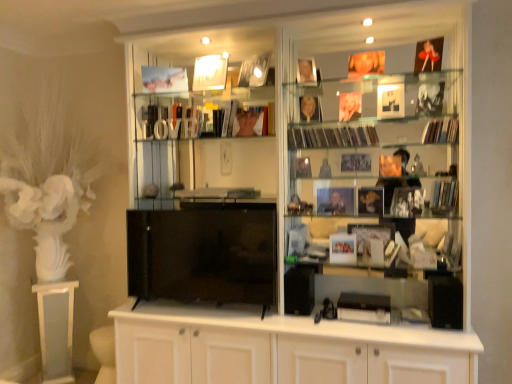
Question: Choose the correct answer: Is shiny plastic magazines at center right, arranged as the 2th magazine when viewed from the top, inside matte paper magazine at upper right, which is the 1th magazine in top-to-bottom order, or outside it?

Choices:
 (A) outside
 (B) inside

Answer: (A)

Question: Considering the positions of shiny plastic magazines at center right, arranged as the 2th magazine when viewed from the top, and matte paper magazine at upper right, the fifth magazine positioned from the bottom, in the image, is shiny plastic magazines at center right, arranged as the 2th magazine when viewed from the top, wider or thinner than matte paper magazine at upper right, the fifth magazine positioned from the bottom,?

Choices:
 (A) thin
 (B) wide

Answer: (A)

Question: Which of these objects is positioned farthest from the matte paper magazine at center, the third magazine positioned from the top?

Choices:
 (A) black glossy tv at center
 (B) matte black book at right, the second magazine positioned from the bottom
 (C) matte white photo frame at center, the second book viewed from the back
 (D) white glossy cupboard at center
 (E) black matte magazine at center, placed as the 1th magazine when sorted from bottom to top

Answer: (A)

Question: Which object is positioned closest to the matte paper magazine at center, which appears as the 3th magazine when ordered from the bottom?

Choices:
 (A) shiny plastic magazines at center right, which is counted as the fourth magazine, starting from the bottom
 (B) matte black book at right, the second magazine positioned from the bottom
 (C) black glossy tv at center
 (D) white glossy pedestal at left
 (E) matte gold photo frame at upper center, which is counted as the 1th book, starting from the back

Answer: (A)